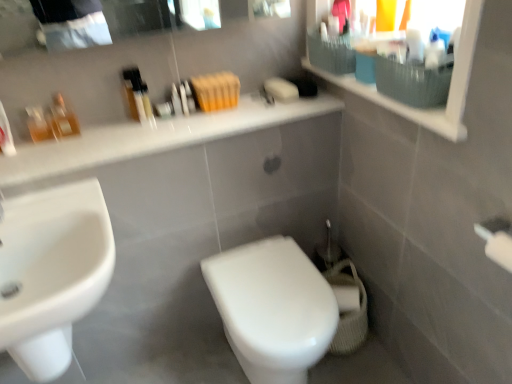
Locate an element on the screen. vacant space to the right of translucent glass bottles at left, which is counted as the first toiletry, starting from the left is located at coordinates (100, 138).